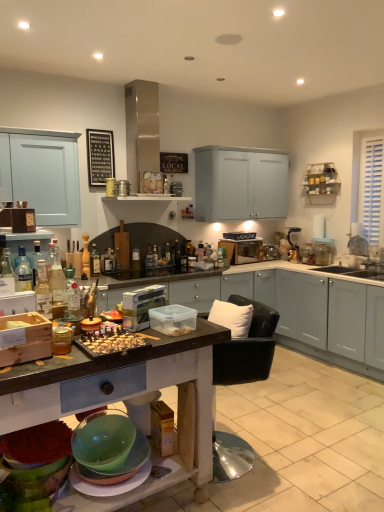
Where is `free space in front of translucent glass bottle at center, which ranks as the 4th bottle in front-to-back order`? The height and width of the screenshot is (512, 384). free space in front of translucent glass bottle at center, which ranks as the 4th bottle in front-to-back order is located at coordinates (94, 280).